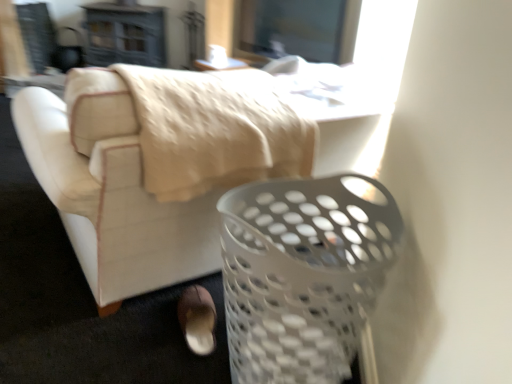
Question: Is point (141, 244) closer or farther from the camera than point (212, 317)?

Choices:
 (A) farther
 (B) closer

Answer: (B)

Question: Based on their positions, is white plastic laundry basket at lower right located to the left or right of brown suede shoe at lower center?

Choices:
 (A) left
 (B) right

Answer: (B)

Question: Considering the real-world distances, which object is farthest from the brown suede shoe at lower center?

Choices:
 (A) white plastic basket at lower right
 (B) white plastic table at upper center
 (C) white plastic laundry basket at lower right

Answer: (B)

Question: Which is nearer to the white plastic laundry basket at lower right?

Choices:
 (A) white plastic table at upper center
 (B) white plastic basket at lower right
 (C) brown suede shoe at lower center

Answer: (C)